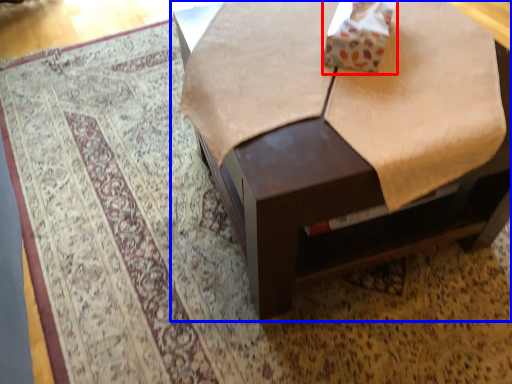
Question: Which of the following is the farthest to the observer, cardboard box (highlighted by a red box) or table (highlighted by a blue box)?

Choices:
 (A) cardboard box
 (B) table

Answer: (A)